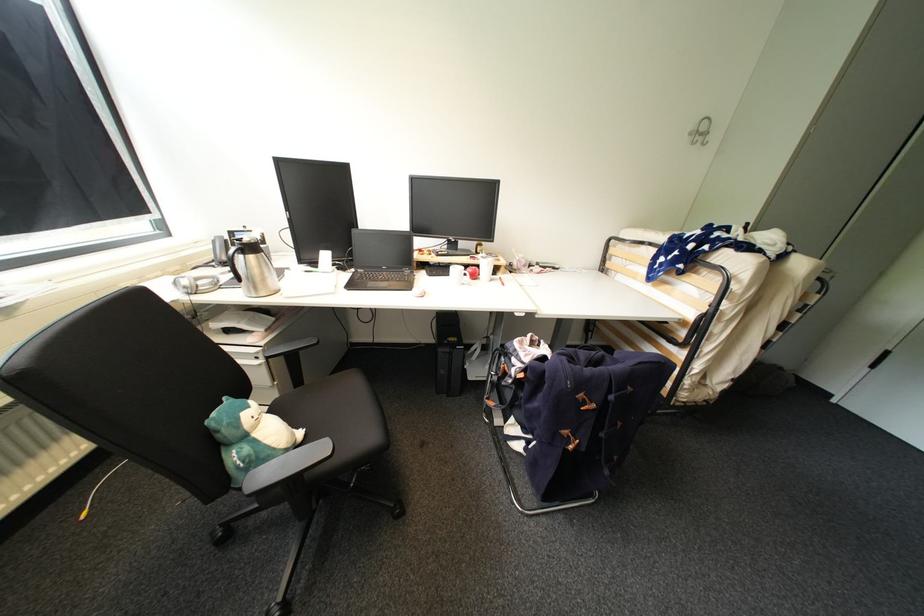
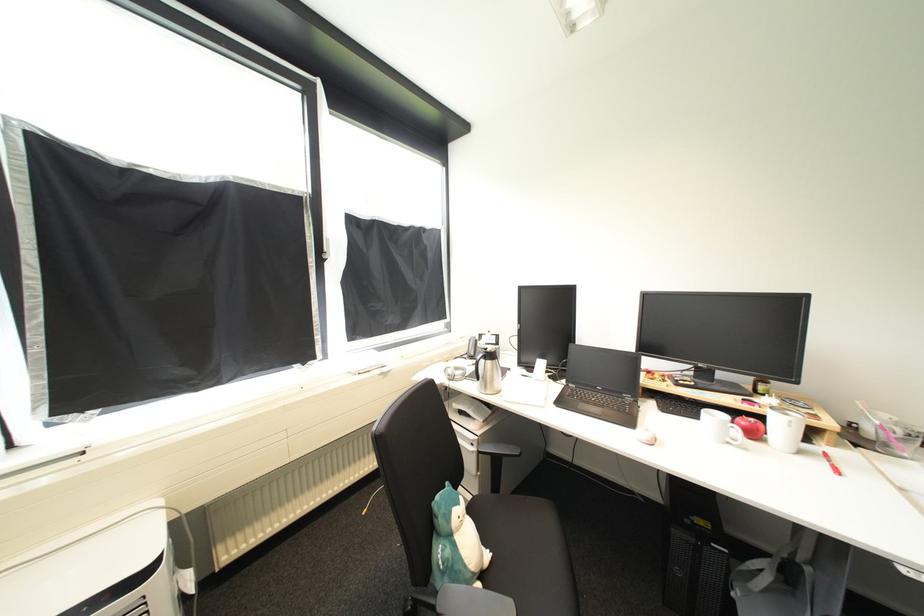
Find the pixel in the second image that matches pixel 307 435 in the first image.

(493, 557)